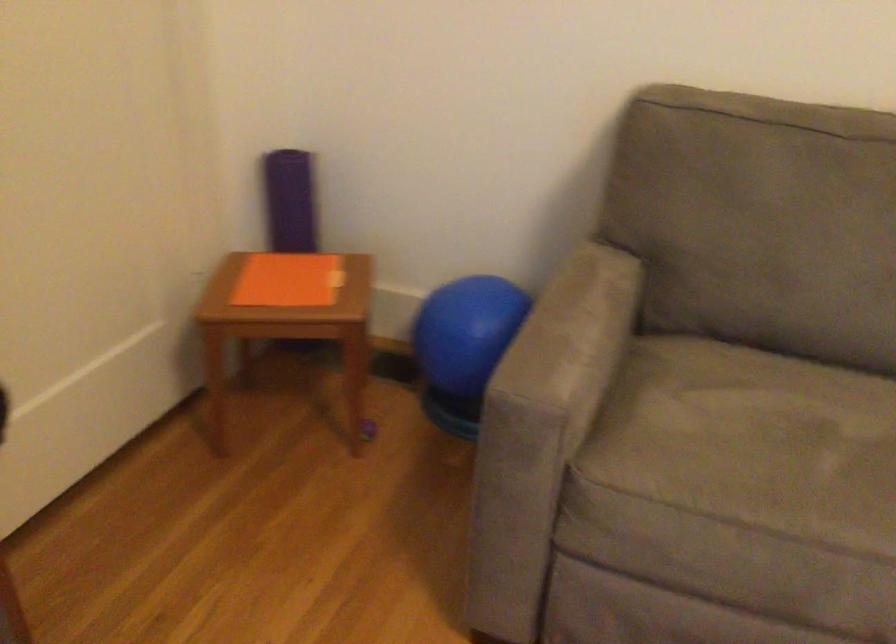
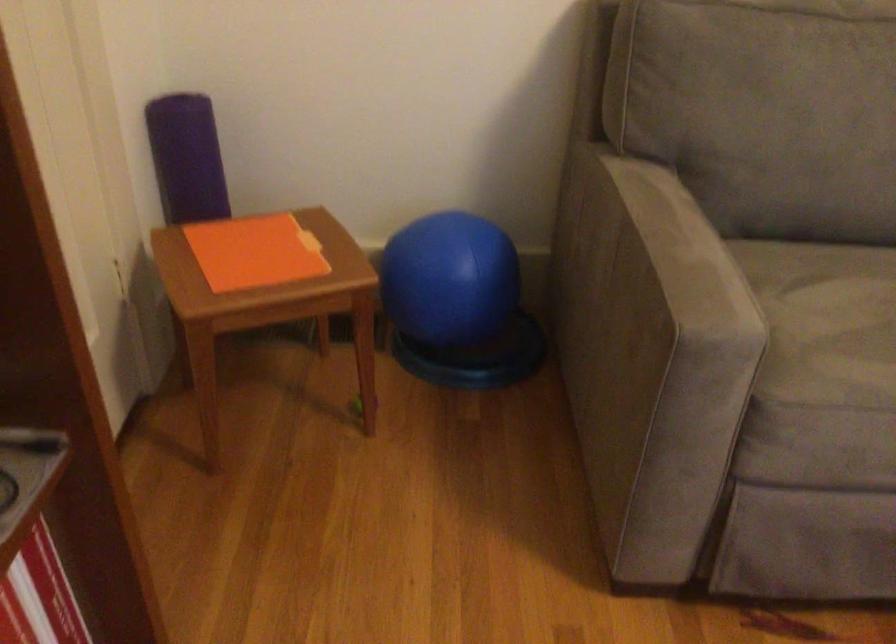
In a continuous first-person perspective shot, in which direction is the camera moving?

The movement direction of the cameraman is left, forward.